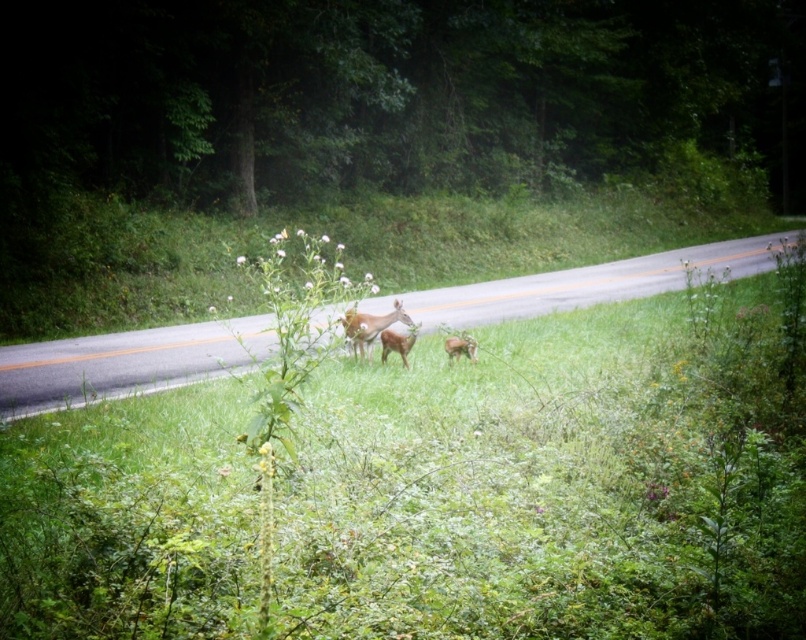
You are a wildlife photographer aiming to capture both the brown matte deer at center and the brown furry deer at center in a single frame. Based on their positions, which deer should you focus on first to ensure both are in the shot?

The brown matte deer at center is located above the brown furry deer at center, so you should focus on the brown furry deer at center first to ensure both are within the frame.

You are standing at the point labeled as point (441, 484) in the image. What type of terrain are you currently standing on?

The point (441, 484) is on green leafy grass at center, so you are standing on green leafy grass.

You are a hiker who has just spotted the green grass at center and the brown matte deer at center from your current position. How far apart are these two features from each other?

The green grass at center is 33.90 feet away from the brown matte deer at center.